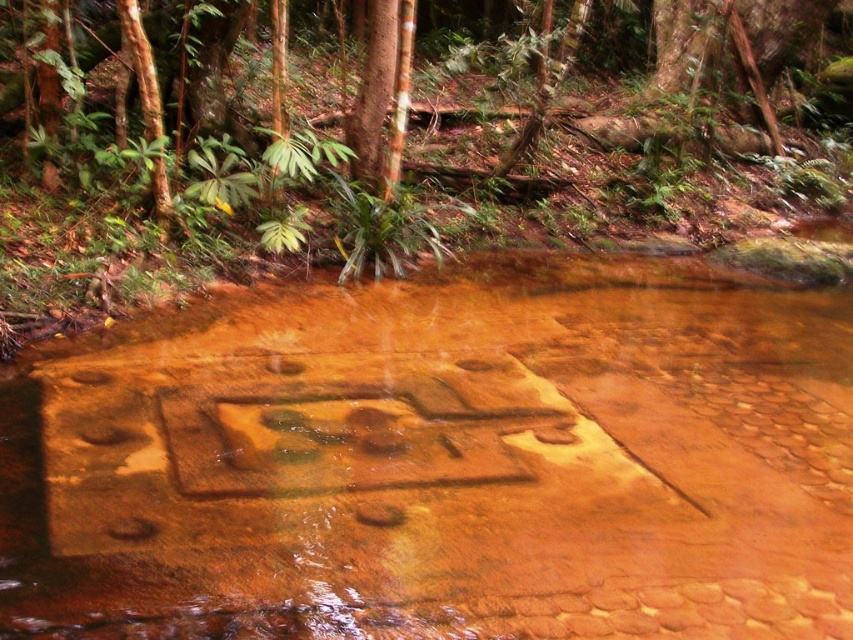
Is brown textured mud at center below brown stone forest at center?

Correct, brown textured mud at center is located below brown stone forest at center.

Does brown textured mud at center appear on the right side of brown stone forest at center?

In fact, brown textured mud at center is to the left of brown stone forest at center.

Between point (131, 406) and point (751, 38), which one is positioned in front?

Point (131, 406) is in front.

I want to click on brown textured mud at center, so point(442,460).